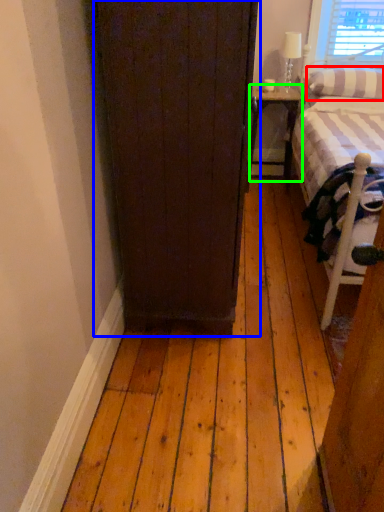
Question: Based on their relative distances, which object is nearer to pillow (highlighted by a red box)? Choose from door (highlighted by a blue box) and nightstand (highlighted by a green box).

Choices:
 (A) door
 (B) nightstand

Answer: (B)